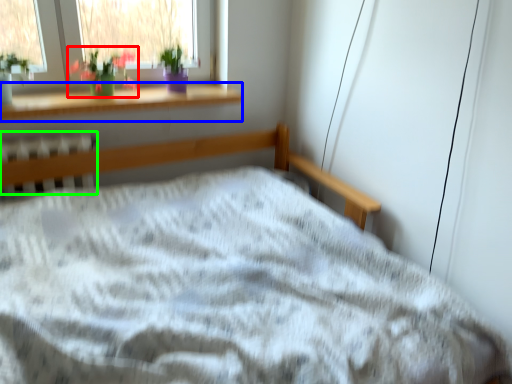
Question: Estimate the real-world distances between objects in this image. Which object is farther from floral arrangement (highlighted by a red box), window sill (highlighted by a blue box) or radiator (highlighted by a green box)?

Choices:
 (A) window sill
 (B) radiator

Answer: (B)